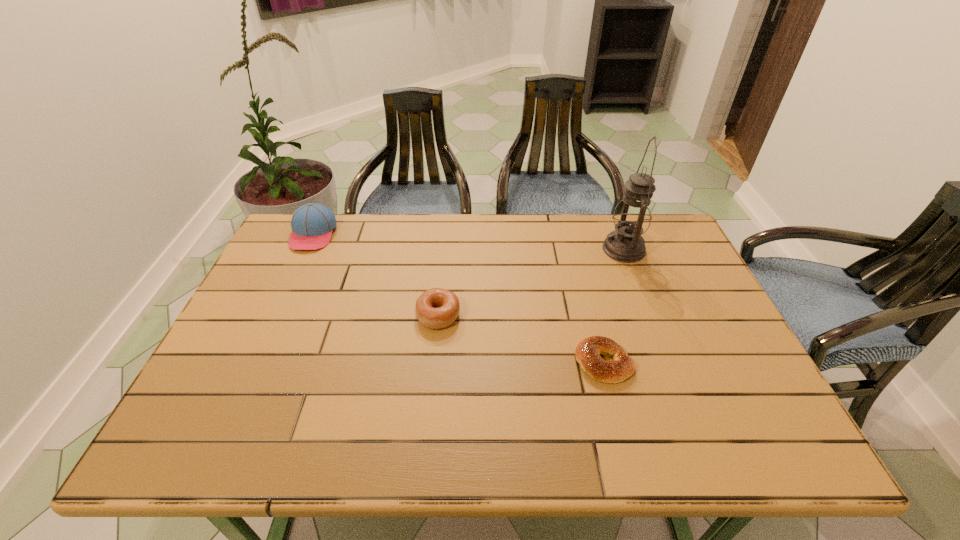
Where is `vacant region located on the right of the taller bagel`? vacant region located on the right of the taller bagel is located at coordinates [x=506, y=315].

Identify the location of free spot located on the right of the third object from left to right. Image resolution: width=960 pixels, height=540 pixels. (712, 363).

Locate an element on the screen. This screenshot has width=960, height=540. oil lamp that is at the far edge is located at coordinates (632, 216).

Find the location of a particular element. The image size is (960, 540). baseball cap positioned at the far edge is located at coordinates (312, 224).

Find the location of a particular element. Image resolution: width=960 pixels, height=540 pixels. object situated at the left edge is located at coordinates click(x=312, y=224).

Identify the location of object that is at the right edge. (632, 216).

In order to click on object that is positioned at the far left corner in this screenshot , I will do `click(312, 224)`.

Locate an element on the screen. The height and width of the screenshot is (540, 960). object present at the far right corner is located at coordinates point(632,216).

In the image, there is a desktop. Identify the location of free region at the far edge. (511, 256).

The image size is (960, 540). In order to click on vacant space at the near edge of the desktop in this screenshot , I will do `click(597, 450)`.